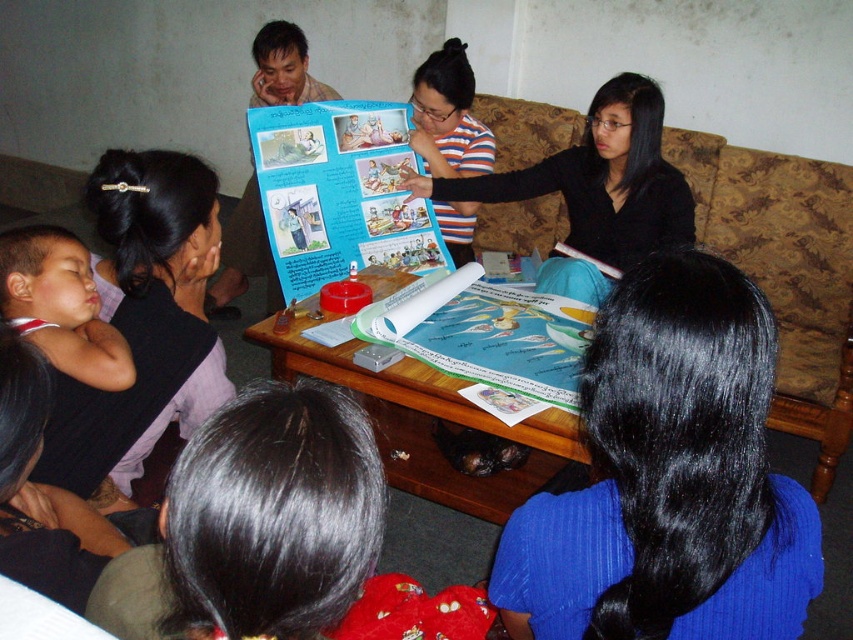
You are a photographer trying to capture a clear shot of both the blue fabric hair at lower right and the black matte poster at center. Based on their heights, which object should you focus on first to ensure both are in frame?

The blue fabric hair at lower right has a lesser height compared to the black matte poster at center, so you should focus on the black matte poster at center first to ensure both are in frame.

You are organizing a small presentation in the living room and need to place both the black matte poster at center and the wooden table at center. Based on the scene, which object is larger?

The black matte poster at center is bigger than the wooden table at center, so the poster is larger.